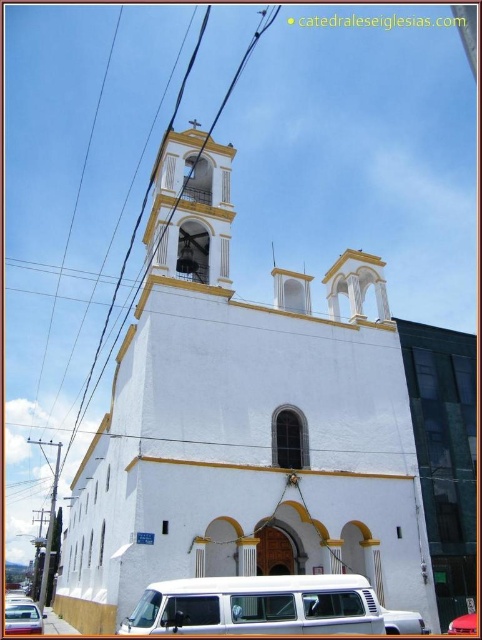
You are standing in front of the church and want to take a photo of the white smooth bell tower at upper center without the white matte van at center blocking the view. Is the bell tower visible above or below the van?

The white smooth bell tower at upper center is located below the white matte van at center, so the bell tower would be visible below the van.

You are standing at the entrance of the white church and want to take a photo of the point marked at coordinates point (x=72, y=504). Considering your camera has a maximum focus range of 300 feet, will you be able to capture a clear photo of that point?

The distance of point (x=72, y=504) from the camera is 337.35 feet, which exceeds the camera maximum focus range of 300 feet. Therefore, the camera cannot capture a clear photo of that point.

You are a photographer standing in front of the white church with yellow trim. You notice two metallic silver vans in the scene. Which van is taller, the metallic silver van at lower left or the metallic silver van at center?

The metallic silver van at lower left has a greater height compared to the metallic silver van at center, so the metallic silver van at lower left is taller.